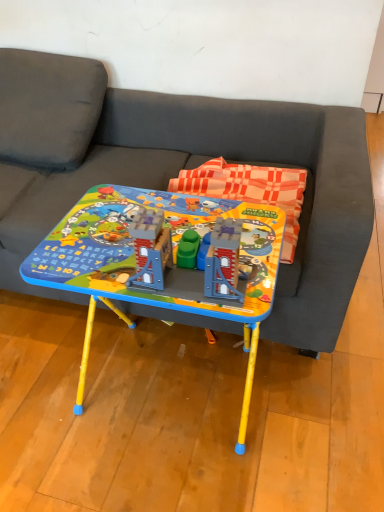
This screenshot has width=384, height=512. Find the location of `vacant space to the right of matte plastic table at center`. vacant space to the right of matte plastic table at center is located at coordinates (316, 406).